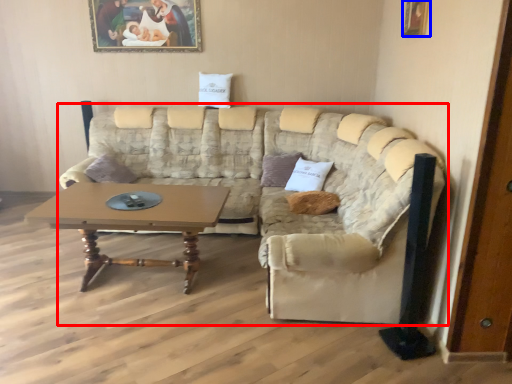
Question: Among these objects, which one is nearest to the camera, studio couch (highlighted by a red box) or picture frame (highlighted by a blue box)?

Choices:
 (A) studio couch
 (B) picture frame

Answer: (A)